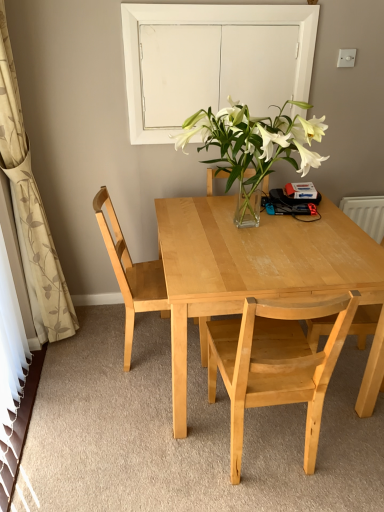
Where is `vacant area that lies between beige floral fabric curtain at left and light wood chair at left, the third chair from the right`? vacant area that lies between beige floral fabric curtain at left and light wood chair at left, the third chair from the right is located at coordinates (100, 342).